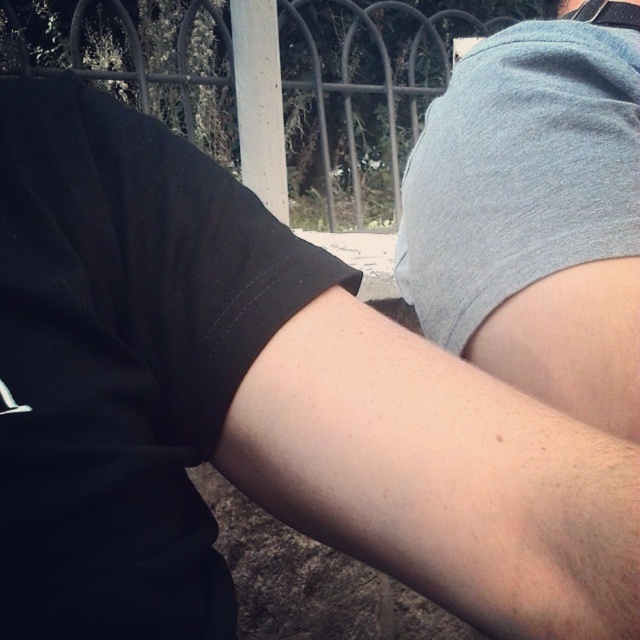
Question: Can you confirm if skinny white arm at center is bigger than gray cotton shirt at upper right?

Choices:
 (A) no
 (B) yes

Answer: (A)

Question: Which point is farther to the camera?

Choices:
 (A) (195, 337)
 (B) (588, 388)

Answer: (B)

Question: Among these objects, which one is nearest to the camera?

Choices:
 (A) gray cotton shirt at upper right
 (B) skinny white arm at center

Answer: (B)

Question: Does skinny white arm at center appear over gray cotton shirt at upper right?

Choices:
 (A) no
 (B) yes

Answer: (A)

Question: Which point is farther to the camera?

Choices:
 (A) skinny white arm at center
 (B) gray cotton shirt at upper right

Answer: (B)

Question: Is skinny white arm at center above gray cotton shirt at upper right?

Choices:
 (A) yes
 (B) no

Answer: (B)